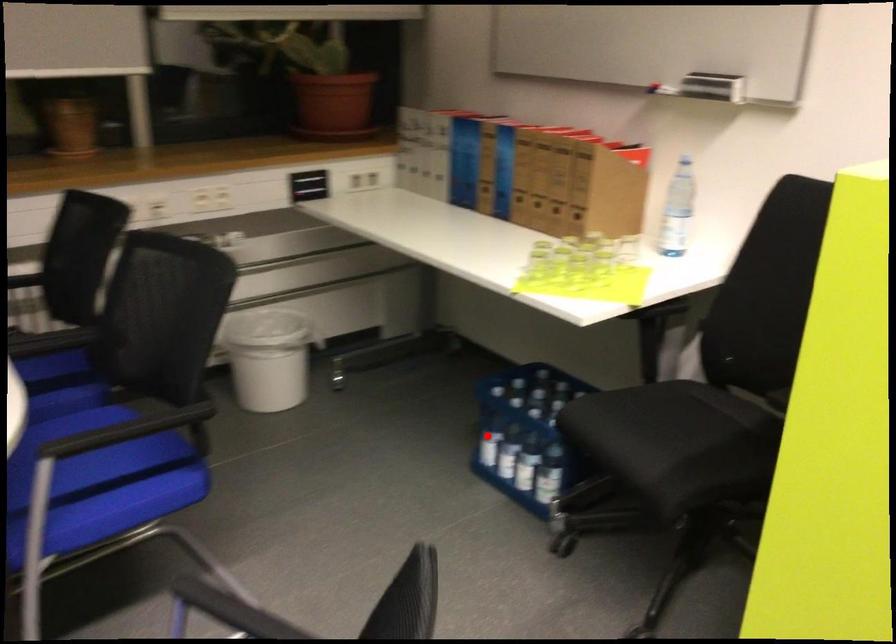
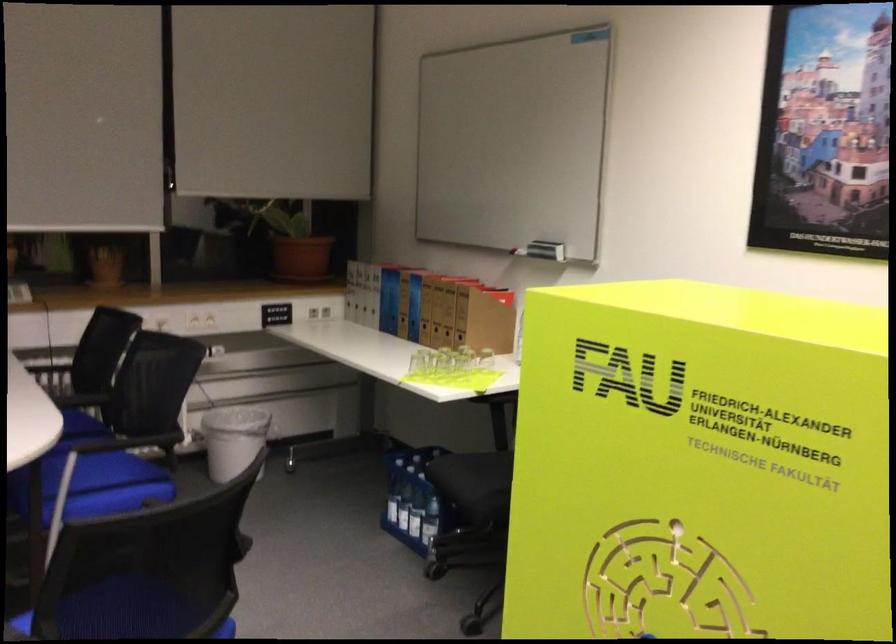
Question: I am providing you with two images of the same scene from different viewpoints. A red point is marked on the first image. Is the red point's position out of view in image 2?

Choices:
 (A) Yes
 (B) No

Answer: (B)